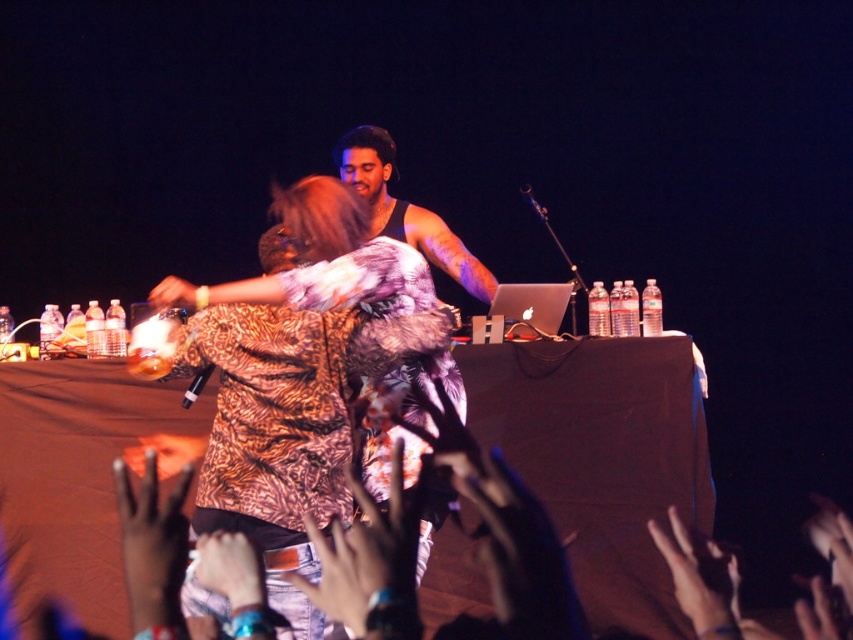
You are a photographer at the concert. You want to capture a photo where the leopard print shirt at center is clearly visible above the metallic silver microphone at center. Based on the scene description, is this possible?

Yes, the leopard print shirt at center is taller than the metallic silver microphone at center, so it can be positioned to be visible above it in the photo.

You are standing in the crowd at the concert. You see two points in the image, point (335, 237) and point (535, 204). Which point is closer to you?

Point (335, 237) is closer to the camera than point (535, 204), so the point (335, 237) is closer to you.